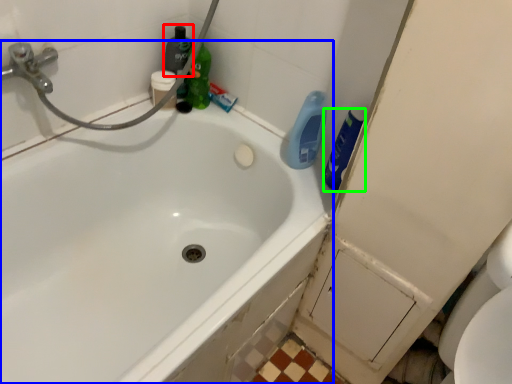
Question: Considering the real-world distances, which object is farthest from cleaning product (highlighted by a red box)? bathtub (highlighted by a blue box) or cleaning product (highlighted by a green box)?

Choices:
 (A) bathtub
 (B) cleaning product

Answer: (A)